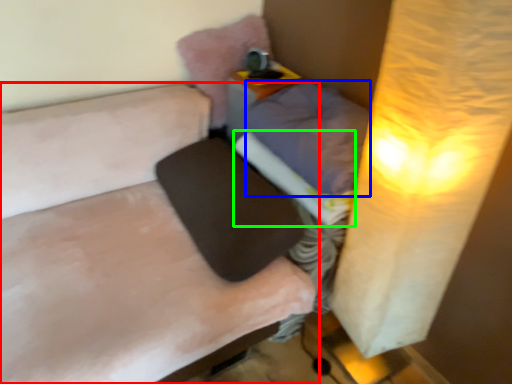
Question: Which is nearer to the furniture (highlighted by a red box)? pillow (highlighted by a blue box) or sheet (highlighted by a green box).

Choices:
 (A) pillow
 (B) sheet

Answer: (B)